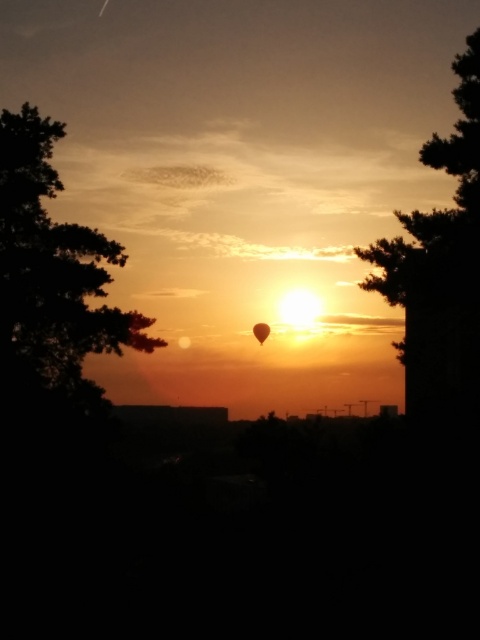
Where is `silky brown tree at right`? Image resolution: width=480 pixels, height=640 pixels. silky brown tree at right is located at coordinates (441, 268).

Between point (407, 308) and point (257, 340), which one is positioned in front?

Positioned in front is point (407, 308).

You are a GUI agent. You are given a task and a screenshot of the screen. Output one action in this format:
    pyautogui.click(x=<x>, y=<y>)
    Task: Click on the silky brown tree at right
    The width and height of the screenshot is (480, 640).
    Given the screenshot: What is the action you would take?
    pyautogui.click(x=441, y=268)

Where is `silky brown tree at right`? The width and height of the screenshot is (480, 640). silky brown tree at right is located at coordinates (441, 268).

Is silhouette leafy tree at left thinner than silky brown tree at right?

Correct, silhouette leafy tree at left's width is less than silky brown tree at right's.

Locate an element on the screen. silhouette leafy tree at left is located at coordinates (51, 276).

Image resolution: width=480 pixels, height=640 pixels. What do you see at coordinates (51, 276) in the screenshot? I see `silhouette leafy tree at left` at bounding box center [51, 276].

What are the coordinates of `silhouette leafy tree at left` in the screenshot? It's located at (51, 276).

The image size is (480, 640). Describe the element at coordinates (51, 276) in the screenshot. I see `silhouette leafy tree at left` at that location.

Is the position of silhouette leafy tree at left more distant than that of translucent orange balloon at center?

No, silhouette leafy tree at left is in front of translucent orange balloon at center.

Between point (12, 221) and point (257, 336), which one is positioned in front?

Point (12, 221)

What are the coordinates of `silhouette leafy tree at left` in the screenshot? It's located at pos(51,276).